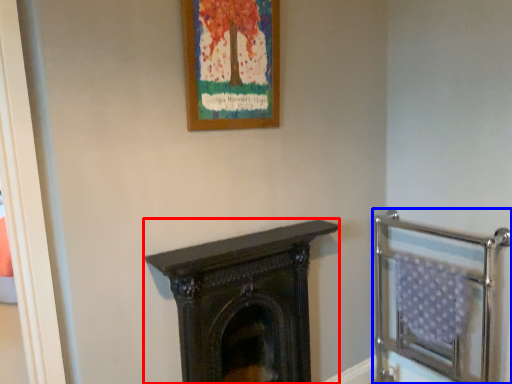
Question: Which of the following is the closest to the observer, fireplace (highlighted by a red box) or balustrade (highlighted by a blue box)?

Choices:
 (A) fireplace
 (B) balustrade

Answer: (A)